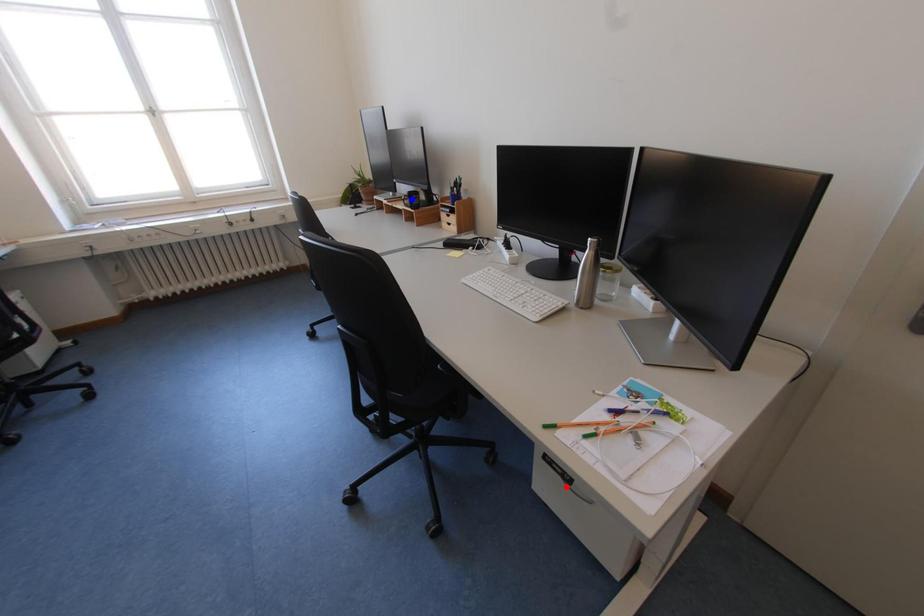
Question: Which of the two points in the image is closer to the camera?

Choices:
 (A) Blue point is closer.
 (B) Red point is closer.

Answer: (B)